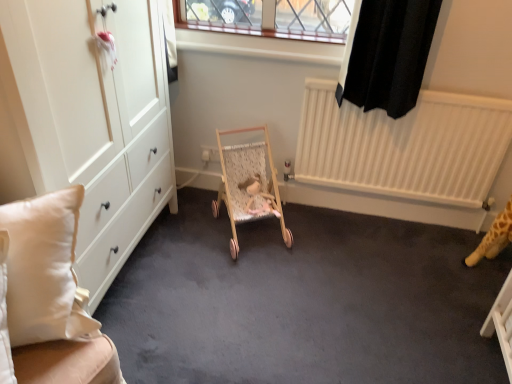
Question: From the image's perspective, is white fabric cushion at left positioned above or below wooden baby carriage at center?

Choices:
 (A) above
 (B) below

Answer: (B)

Question: Is point (53, 370) positioned closer to the camera than point (254, 205)?

Choices:
 (A) closer
 (B) farther

Answer: (A)

Question: In terms of height, does white fabric cushion at left look taller or shorter compared to wooden baby carriage at center?

Choices:
 (A) tall
 (B) short

Answer: (A)

Question: From a real-world perspective, is wooden baby carriage at center positioned above or below white fabric cushion at left?

Choices:
 (A) above
 (B) below

Answer: (B)

Question: Is wooden baby carriage at center taller or shorter than white fabric cushion at left?

Choices:
 (A) tall
 (B) short

Answer: (B)

Question: Based on their positions, is wooden baby carriage at center located to the left or right of white fabric cushion at left?

Choices:
 (A) right
 (B) left

Answer: (A)

Question: In the image, is wooden baby carriage at center positioned in front of or behind white fabric cushion at left?

Choices:
 (A) behind
 (B) front

Answer: (A)